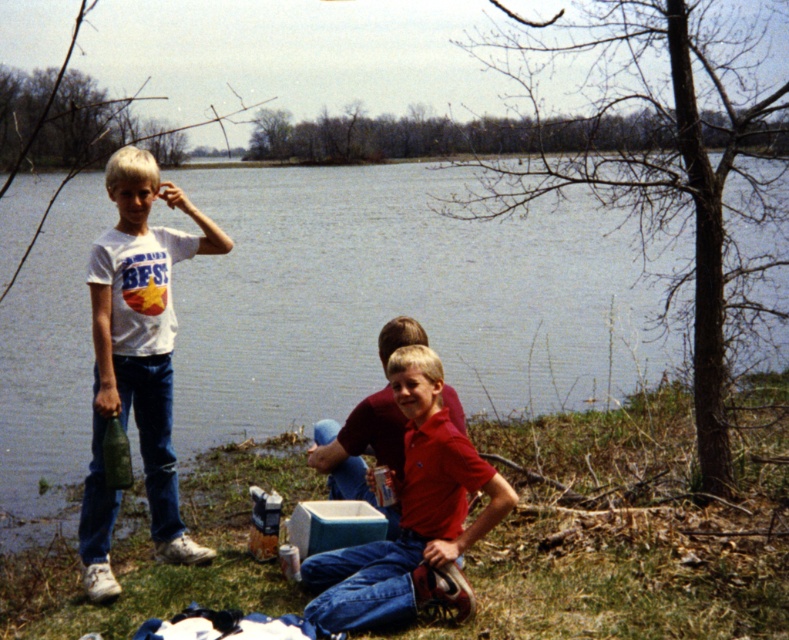
Is blue water at center closer to camera compared to matte red shirt at center?

No, it is behind matte red shirt at center.

Who is shorter, blue water at center or matte red shirt at center?

Standing shorter between the two is matte red shirt at center.

Between point (42, 364) and point (417, 346), which one is positioned in front?

Point (417, 346) is more forward.

You are a GUI agent. You are given a task and a screenshot of the screen. Output one action in this format:
    pyautogui.click(x=<x>, y=<y>)
    Task: Click on the blue water at center
    The width and height of the screenshot is (789, 640).
    Given the screenshot: What is the action you would take?
    pyautogui.click(x=397, y=300)

Does white matte t-shirt at left come behind matte red shirt at center?

Yes, it is behind matte red shirt at center.

Based on the photo, can you confirm if white matte t-shirt at left is taller than matte red shirt at center?

Correct, white matte t-shirt at left is much taller as matte red shirt at center.

Where is `white matte t-shirt at left`? This screenshot has height=640, width=789. white matte t-shirt at left is located at coordinates (137, 358).

Which is below, blue water at center or white matte t-shirt at left?

white matte t-shirt at left is lower down.

Between point (282, 170) and point (110, 413), which one is positioned in front?

Point (110, 413) is more forward.

Between point (507, 300) and point (151, 186), which one is positioned in front?

Point (151, 186)

What are the coordinates of `blue water at center` in the screenshot? It's located at (397, 300).